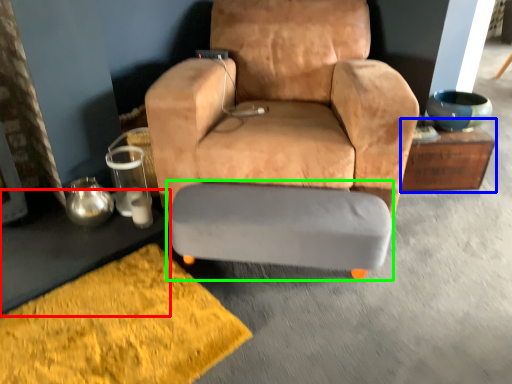
Question: Based on their relative distances, which object is farther from table (highlighted by a red box)? Choose from table (highlighted by a blue box) and swivel chair (highlighted by a green box).

Choices:
 (A) table
 (B) swivel chair

Answer: (A)